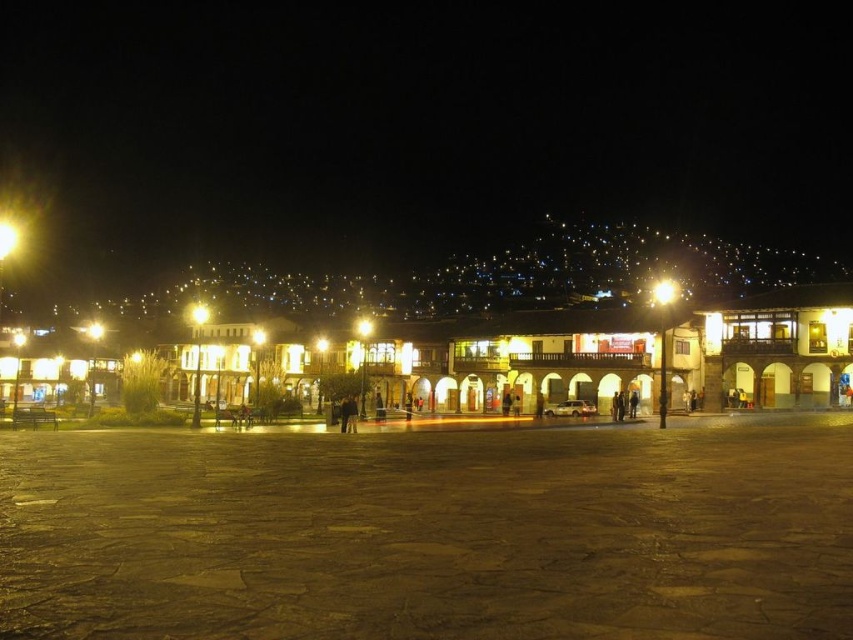
Is point (352, 586) closer to viewer compared to point (677, 298)?

Yes.

Can you confirm if brown stone pavement at center is thinner than bright metallic streetlight at upper center?

Incorrect, brown stone pavement at center's width is not less than bright metallic streetlight at upper center's.

The width and height of the screenshot is (853, 640). Find the location of `brown stone pavement at center`. brown stone pavement at center is located at coordinates (430, 532).

Where is `brown stone pavement at center`? Image resolution: width=853 pixels, height=640 pixels. brown stone pavement at center is located at coordinates [430, 532].

Who is more forward, (679, 589) or (3, 257)?

Point (679, 589) is in front.

Is point (141, 596) closer to camera compared to point (19, 234)?

Yes.

The height and width of the screenshot is (640, 853). Find the location of `brown stone pavement at center`. brown stone pavement at center is located at coordinates (430, 532).

The height and width of the screenshot is (640, 853). I want to click on brown stone pavement at center, so click(x=430, y=532).

Find the location of a particular element. bright metallic streetlight at upper center is located at coordinates (664, 291).

This screenshot has height=640, width=853. I want to click on bright metallic streetlight at upper center, so click(x=664, y=291).